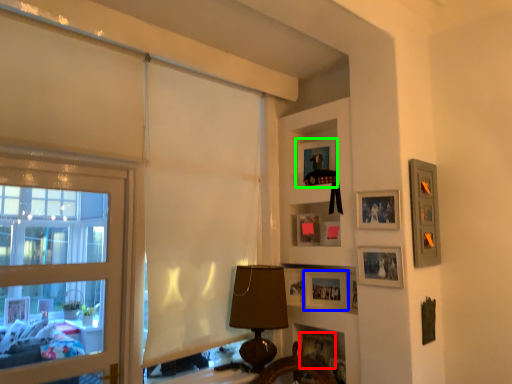
Question: Estimate the real-world distances between objects in this image. Which object is farther from picture frame (highlighted by a red box), picture frame (highlighted by a blue box) or picture frame (highlighted by a green box)?

Choices:
 (A) picture frame
 (B) picture frame

Answer: (B)